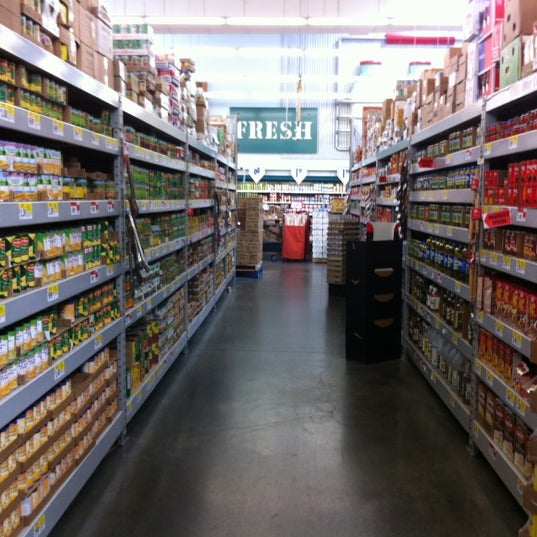
Where is `concrete floor`? This screenshot has height=537, width=537. concrete floor is located at coordinates (238, 301), (200, 440).